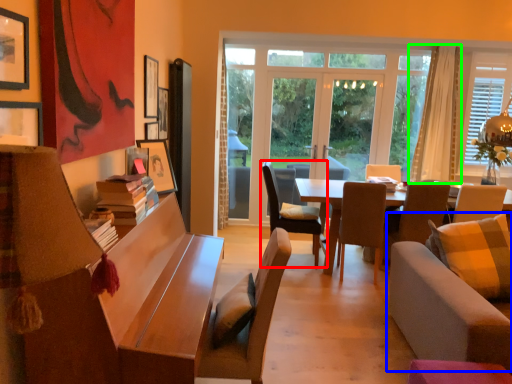
Question: Which object is positioned farthest from chair (highlighted by a red box)? Select from studio couch (highlighted by a blue box) and curtain (highlighted by a green box).

Choices:
 (A) studio couch
 (B) curtain

Answer: (B)